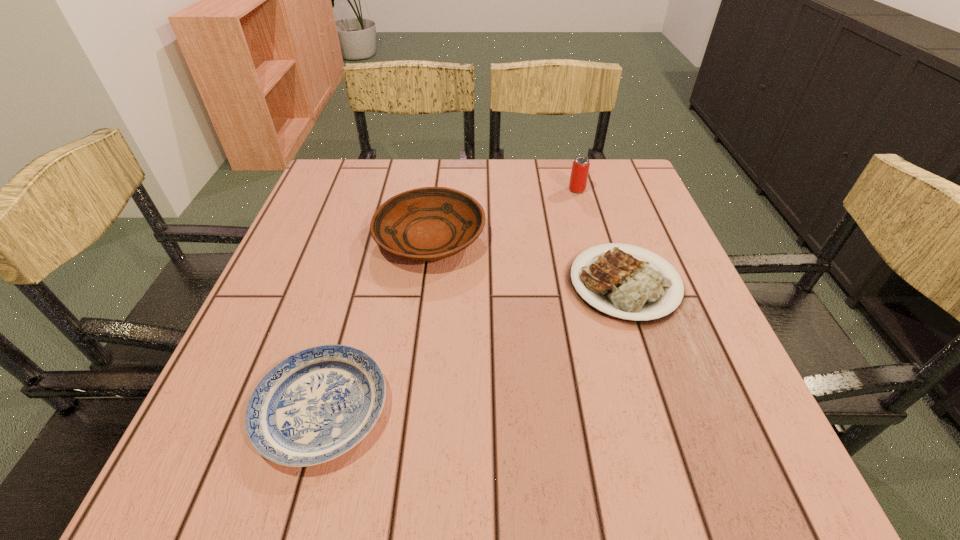
Identify the location of free spot between the second tallest object and the nearest object. This screenshot has height=540, width=960. (376, 323).

What are the coordinates of `vacant area that lies between the second tallest object and the rightmost plate` in the screenshot? It's located at (527, 261).

Select which object appears as the second closest to the farthest object. Please provide its 2D coordinates. Your answer should be formatted as a tuple, i.e. [(x, y)], where the tuple contains the x and y coordinates of a point satisfying the conditions above.

[(430, 223)]

Locate an element on the screen. The height and width of the screenshot is (540, 960). object that stands as the closest to the beer can is located at coordinates (620, 285).

Find the location of a particular element. The image size is (960, 540). plate that is the second closest to the second tallest object is located at coordinates (317, 404).

At what (x,y) coordinates should I click in order to perform the action: click on plate that stands as the second closest to the nearest object. Please return your answer as a coordinate pair (x, y). This screenshot has height=540, width=960. Looking at the image, I should click on (620, 285).

Find the location of a particular element. This screenshot has width=960, height=540. free region that satisfies the following two spatial constraints: 1. on the back side of the nearest plate; 2. on the left side of the rightmost plate is located at coordinates (357, 284).

Find the location of a particular element. The width and height of the screenshot is (960, 540). vacant region that satisfies the following two spatial constraints: 1. on the front side of the rightmost plate; 2. on the left side of the farthest object is located at coordinates (604, 284).

The width and height of the screenshot is (960, 540). Identify the location of free spot that satisfies the following two spatial constraints: 1. on the back side of the nearest object; 2. on the left side of the farthest object. (384, 190).

Identify the location of blank space that satisfies the following two spatial constraints: 1. on the back side of the third shortest object; 2. on the left side of the nearest object. (371, 238).